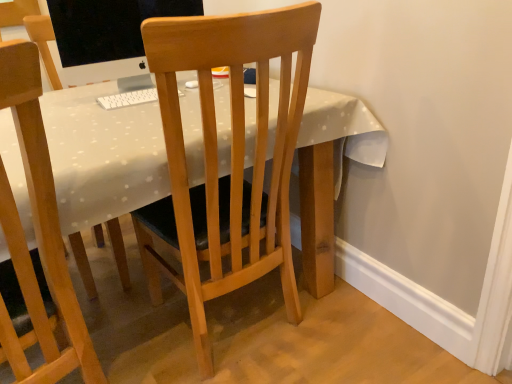
Identify the location of wooden chair at center, the 2th chair viewed from the right. This screenshot has width=512, height=384. pyautogui.click(x=38, y=233).

Locate an element on the screen. The width and height of the screenshot is (512, 384). light wood chair at center, which is the first chair from right to left is located at coordinates (231, 157).

Identify the location of wooden desk at center. (102, 156).

Which of these two, light wood chair at center, which is the first chair from right to left, or wooden chair at center, placed as the first chair when sorted from left to right, stands taller?

light wood chair at center, which is the first chair from right to left, is taller.

Consider the image. From the image's perspective, who appears lower, light wood chair at center, which is the first chair from right to left, or wooden chair at center, placed as the first chair when sorted from left to right?

wooden chair at center, placed as the first chair when sorted from left to right, is shown below in the image.

Is light wood chair at center, which appears as the second chair when viewed from the left, looking in the opposite direction of wooden chair at center, placed as the first chair when sorted from left to right?

No.

Which object is closer to the camera taking this photo, light wood chair at center, which appears as the second chair when viewed from the left, or wooden chair at center, the 2th chair viewed from the right?

wooden chair at center, the 2th chair viewed from the right.

Considering the sizes of objects wooden chair at center, placed as the first chair when sorted from left to right, and matte black monitor at upper left in the image provided, who is shorter, wooden chair at center, placed as the first chair when sorted from left to right, or matte black monitor at upper left?

Standing shorter between the two is matte black monitor at upper left.

Considering the positions of objects wooden chair at center, the 2th chair viewed from the right, and matte black monitor at upper left in the image provided, who is more to the right, wooden chair at center, the 2th chair viewed from the right, or matte black monitor at upper left?

matte black monitor at upper left.

From the image's perspective, is wooden chair at center, placed as the first chair when sorted from left to right, under matte black monitor at upper left?

Indeed, from the image's perspective, wooden chair at center, placed as the first chair when sorted from left to right, is shown beneath matte black monitor at upper left.

Considering the relative sizes of wooden chair at center, the 2th chair viewed from the right, and matte black monitor at upper left in the image provided, is wooden chair at center, the 2th chair viewed from the right, wider than matte black monitor at upper left?

Indeed, wooden chair at center, the 2th chair viewed from the right, has a greater width compared to matte black monitor at upper left.

What's the angular difference between light wood chair at center, which is the first chair from right to left, and wooden desk at center's facing directions?

The angle between the facing direction of light wood chair at center, which is the first chair from right to left, and the facing direction of wooden desk at center is 90 degrees.

Is light wood chair at center, which appears as the second chair when viewed from the left, wider or thinner than wooden desk at center?

Clearly, light wood chair at center, which appears as the second chair when viewed from the left, has less width compared to wooden desk at center.

In the scene shown: In terms of height, does light wood chair at center, which is the first chair from right to left, look taller or shorter compared to wooden desk at center?

Clearly, light wood chair at center, which is the first chair from right to left, is taller compared to wooden desk at center.

From the image's perspective, is light wood chair at center, which is the first chair from right to left, on top of wooden desk at center?

Yes.

Looking at this image, is light wood chair at center, which is the first chair from right to left, far from matte black monitor at upper left?

No, light wood chair at center, which is the first chair from right to left, is not far away from matte black monitor at upper left.

How far apart are light wood chair at center, which appears as the second chair when viewed from the left, and matte black monitor at upper left?

They are 25.53 inches apart.

Between light wood chair at center, which is the first chair from right to left, and matte black monitor at upper left, which one appears on the left side from the viewer's perspective?

Positioned to the left is matte black monitor at upper left.

Is point (148, 38) positioned in front of point (156, 13)?

Yes, it is in front of point (156, 13).

From a real-world perspective, which object stands above the other?

light wood chair at center, which appears as the second chair when viewed from the left, from a real-world perspective.

Is light wood chair at center, which is the first chair from right to left, at the back of wooden desk at center?

No, wooden desk at center's orientation is not away from light wood chair at center, which is the first chair from right to left.

Does wooden desk at center have a lesser width compared to light wood chair at center, which appears as the second chair when viewed from the left?

No, wooden desk at center is not thinner than light wood chair at center, which appears as the second chair when viewed from the left.

Is the position of wooden desk at center less distant than that of light wood chair at center, which is the first chair from right to left?

Yes, it is in front of light wood chair at center, which is the first chair from right to left.

Consider the image. Is wooden chair at center, the 2th chair viewed from the right, thinner than light wood chair at center, which is the first chair from right to left?

Indeed, wooden chair at center, the 2th chair viewed from the right, has a lesser width compared to light wood chair at center, which is the first chair from right to left.

Can you tell me how much wooden chair at center, the 2th chair viewed from the right, and light wood chair at center, which appears as the second chair when viewed from the left, differ in facing direction?

The angular difference between wooden chair at center, the 2th chair viewed from the right, and light wood chair at center, which appears as the second chair when viewed from the left, is 0.000171 degrees.

From the image's perspective, is wooden chair at center, the 2th chair viewed from the right, on light wood chair at center, which appears as the second chair when viewed from the left?

No, from the image's perspective, wooden chair at center, the 2th chair viewed from the right, is not above light wood chair at center, which appears as the second chair when viewed from the left.

Consider the image. Is matte black monitor at upper left to the left or to the right of wooden desk at center in the image?

Based on their positions, matte black monitor at upper left is located to the left of wooden desk at center.

Does matte black monitor at upper left turn towards wooden desk at center?

No, matte black monitor at upper left does not turn towards wooden desk at center.

Is there a large distance between matte black monitor at upper left and wooden desk at center?

They are positioned close to each other.

Considering the relative sizes of matte black monitor at upper left and wooden desk at center in the image provided, is matte black monitor at upper left wider than wooden desk at center?

Incorrect, the width of matte black monitor at upper left does not surpass that of wooden desk at center.

This screenshot has width=512, height=384. I want to click on chair behind the wooden chair at center, the 2th chair viewed from the right, so click(231, 157).

The image size is (512, 384). I want to click on television above the wooden chair at center, placed as the first chair when sorted from left to right (from a real-world perspective), so click(108, 34).

When comparing their distances from wooden chair at center, placed as the first chair when sorted from left to right, does light wood chair at center, which appears as the second chair when viewed from the left, or wooden desk at center seem further?

Among the two, light wood chair at center, which appears as the second chair when viewed from the left, is located further to wooden chair at center, placed as the first chair when sorted from left to right.

Based on their spatial positions, is wooden desk at center or wooden chair at center, the 2th chair viewed from the right, closer to light wood chair at center, which is the first chair from right to left?

The object closer to light wood chair at center, which is the first chair from right to left, is wooden desk at center.

Considering their positions, is light wood chair at center, which appears as the second chair when viewed from the left, positioned further to wooden desk at center than wooden chair at center, the 2th chair viewed from the right?

wooden chair at center, the 2th chair viewed from the right, is positioned further to the anchor wooden desk at center.

Based on their spatial positions, is light wood chair at center, which is the first chair from right to left, or matte black monitor at upper left further from wooden chair at center, placed as the first chair when sorted from left to right?

The object further to wooden chair at center, placed as the first chair when sorted from left to right, is matte black monitor at upper left.

Based on their spatial positions, is matte black monitor at upper left or wooden chair at center, placed as the first chair when sorted from left to right, closer to wooden desk at center?

Among the two, wooden chair at center, placed as the first chair when sorted from left to right, is located nearer to wooden desk at center.

Estimate the real-world distances between objects in this image. Which object is closer to wooden desk at center, wooden chair at center, the 2th chair viewed from the right, or matte black monitor at upper left?

Among the two, wooden chair at center, the 2th chair viewed from the right, is located nearer to wooden desk at center.

Which object lies nearer to the anchor point matte black monitor at upper left, wooden desk at center or wooden chair at center, the 2th chair viewed from the right?

Among the two, wooden desk at center is located nearer to matte black monitor at upper left.

When comparing their distances from wooden chair at center, placed as the first chair when sorted from left to right, does wooden desk at center or light wood chair at center, which appears as the second chair when viewed from the left, seem further?

The object further to wooden chair at center, placed as the first chair when sorted from left to right, is light wood chair at center, which appears as the second chair when viewed from the left.

The width and height of the screenshot is (512, 384). In order to click on chair between wooden chair at center, the 2th chair viewed from the right, and matte black monitor at upper left, along the z-axis in this screenshot , I will do `click(231, 157)`.

At what (x,y) coordinates should I click in order to perform the action: click on desk positioned between wooden chair at center, placed as the first chair when sorted from left to right, and matte black monitor at upper left from near to far. Please return your answer as a coordinate pair (x, y). The width and height of the screenshot is (512, 384). Looking at the image, I should click on (102, 156).

Locate an element on the screen. chair between wooden desk at center and matte black monitor at upper left in the front-back direction is located at coordinates (231, 157).

Where is `desk between wooden chair at center, placed as the first chair when sorted from left to right, and light wood chair at center, which appears as the second chair when viewed from the left`? Image resolution: width=512 pixels, height=384 pixels. desk between wooden chair at center, placed as the first chair when sorted from left to right, and light wood chair at center, which appears as the second chair when viewed from the left is located at coordinates (102, 156).